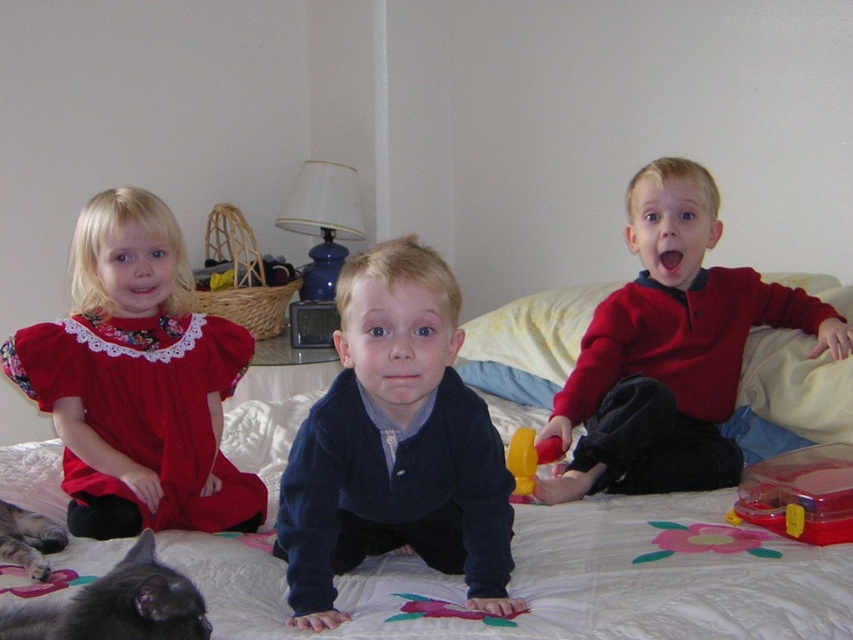
Question: Does navy blue sweater at center come in front of matte red dress at left?

Choices:
 (A) no
 (B) yes

Answer: (B)

Question: Where is matte red dress at left located in relation to translucent plastic container at lower right in the image?

Choices:
 (A) below
 (B) above

Answer: (B)

Question: Which object is positioned closest to the matte red dress at left?

Choices:
 (A) navy blue sweater at center
 (B) red matte sweater at center

Answer: (A)

Question: Which object is positioned farthest from the matte red dress at left?

Choices:
 (A) red matte sweater at center
 (B) navy blue sweater at center
 (C) translucent plastic container at lower right

Answer: (C)

Question: Is white quilted bed at center thinner than translucent plastic container at lower right?

Choices:
 (A) yes
 (B) no

Answer: (B)

Question: Among these objects, which one is farthest from the camera?

Choices:
 (A) white quilted bed at center
 (B) red matte sweater at center
 (C) navy blue sweater at center

Answer: (B)